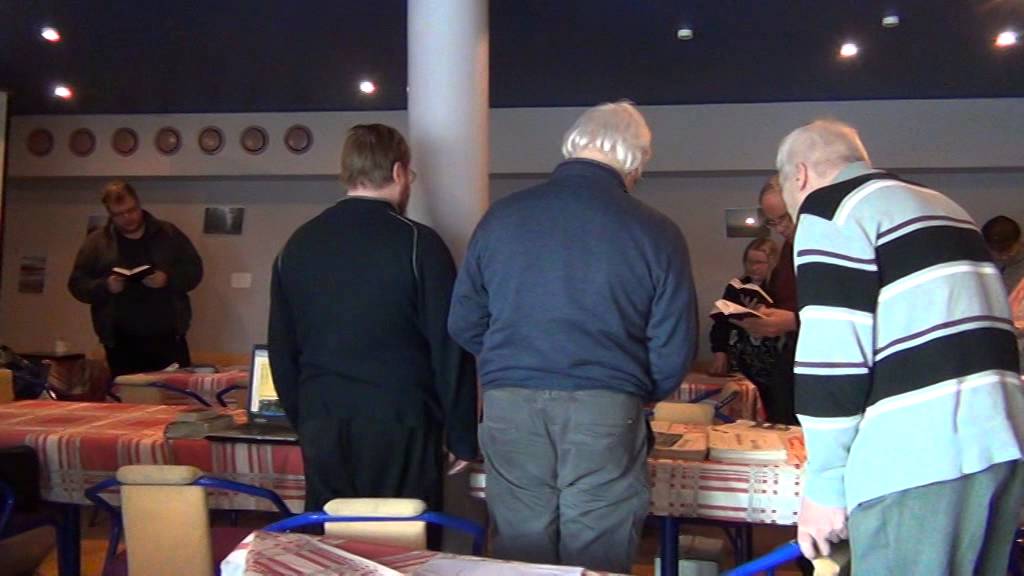
Where is `lights`? lights is located at coordinates (68, 100), (54, 31), (358, 87), (839, 54), (1007, 37).